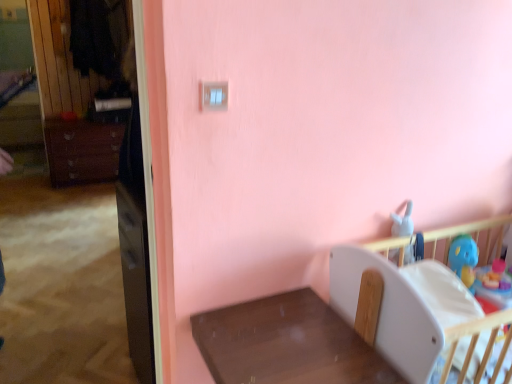
What are the coordinates of `blue rubber duck at right` in the screenshot? It's located at (464, 259).

This screenshot has width=512, height=384. What do you see at coordinates (464, 259) in the screenshot? I see `blue rubber duck at right` at bounding box center [464, 259].

Where is `blue rubber duck at right`? blue rubber duck at right is located at coordinates (464, 259).

How far apart are blue rubber duck at right and white plastic infant bed at lower right?

14.43 inches.

From the image's perspective, which is below, blue rubber duck at right or white plastic infant bed at lower right?

white plastic infant bed at lower right, from the image's perspective.

What's the angular difference between blue rubber duck at right and white plastic infant bed at lower right's facing directions?

0.409 degrees.

Between blue rubber duck at right and white plastic infant bed at lower right, which one is positioned in front?

white plastic infant bed at lower right is in front.

What's the angular difference between brown wooden table at lower center and matte brown dresser at left's facing directions?

They differ by 2.76 degrees in their facing directions.

Is brown wooden table at lower center bigger than matte brown dresser at left?

No.

Would you say brown wooden table at lower center contains matte brown dresser at left?

No.

Could you tell me if brown wooden table at lower center is turned towards matte brown dresser at left?

No, brown wooden table at lower center is not turned towards matte brown dresser at left.

From the image's perspective, is matte brown dresser at left positioned above or below brown wooden table at lower center?

Based on their image positions, matte brown dresser at left is located above brown wooden table at lower center.

Is matte brown dresser at left situated inside brown wooden table at lower center or outside?

matte brown dresser at left is not inside brown wooden table at lower center, it's outside.

Is matte brown dresser at left positioned with its back to brown wooden table at lower center?

matte brown dresser at left is not turned away from brown wooden table at lower center.

Is matte brown dresser at left not near brown wooden table at lower center?

matte brown dresser at left is far away from brown wooden table at lower center.

From the image's perspective, is blue rubber duck at right positioned above or below brown wooden table at lower center?

Clearly, from the image's perspective, blue rubber duck at right is above brown wooden table at lower center.

Which point is more forward, (469,285) or (219,359)?

The point (219,359) is in front.

From a real-world perspective, between blue rubber duck at right and brown wooden table at lower center, who is vertically higher?

blue rubber duck at right.

Is blue rubber duck at right taller than brown wooden table at lower center?

In fact, blue rubber duck at right may be shorter than brown wooden table at lower center.

Can you confirm if brown wooden table at lower center is positioned to the left of white plastic infant bed at lower right?

Correct, you'll find brown wooden table at lower center to the left of white plastic infant bed at lower right.

Consider the image. Considering their positions, is brown wooden table at lower center located in front of or behind white plastic infant bed at lower right?

brown wooden table at lower center is positioned closer to the viewer than white plastic infant bed at lower right.

In terms of width, does brown wooden table at lower center look wider or thinner when compared to white plastic infant bed at lower right?

Clearly, brown wooden table at lower center has less width compared to white plastic infant bed at lower right.

Is brown wooden table at lower center positioned beyond the bounds of white plastic infant bed at lower right?

brown wooden table at lower center lies outside white plastic infant bed at lower right's area.

Consider the image. Could you tell me if white plastic infant bed at lower right is turned towards matte black file cabinet at left?

No, white plastic infant bed at lower right is not aimed at matte black file cabinet at left.

Which object is wider, white plastic infant bed at lower right or matte black file cabinet at left?

white plastic infant bed at lower right is wider.

Does white plastic infant bed at lower right lie behind matte black file cabinet at left?

No, white plastic infant bed at lower right is in front of matte black file cabinet at left.

The image size is (512, 384). In order to click on infant bed below the matte black file cabinet at left (from the image's perspective) in this screenshot , I will do `click(417, 315)`.

Which is correct: matte brown dresser at left is inside blue rubber duck at right, or outside of it?

matte brown dresser at left is located beyond the bounds of blue rubber duck at right.

Is matte brown dresser at left to the left of blue rubber duck at right from the viewer's perspective?

Yes.

Is matte brown dresser at left in contact with blue rubber duck at right?

matte brown dresser at left is not next to blue rubber duck at right, and they're not touching.

Which of these two, matte brown dresser at left or blue rubber duck at right, is smaller?

blue rubber duck at right is smaller.

You are a GUI agent. You are given a task and a screenshot of the screen. Output one action in this format:
    pyautogui.click(x=<x>, y=<y>)
    Task: Click on the infant bed on the left of blue rubber duck at right
    The height and width of the screenshot is (384, 512).
    Given the screenshot: What is the action you would take?
    pyautogui.click(x=417, y=315)

Locate an element on the screen. The height and width of the screenshot is (384, 512). furniture that appears on the right of matte brown dresser at left is located at coordinates (287, 344).

From the image, which object appears to be farther from matte black file cabinet at left, brown wooden table at lower center or matte brown dresser at left?

matte brown dresser at left is positioned further to the anchor matte black file cabinet at left.

Considering their positions, is white plastic infant bed at lower right positioned closer to brown wooden table at lower center than blue rubber duck at right?

white plastic infant bed at lower right.

Based on their spatial positions, is brown wooden table at lower center or white plastic infant bed at lower right further from blue rubber duck at right?

Among the two, brown wooden table at lower center is located further to blue rubber duck at right.

Looking at the image, which one is located further to matte brown dresser at left, matte black file cabinet at left or white plastic infant bed at lower right?

Based on the image, white plastic infant bed at lower right appears to be further to matte brown dresser at left.

Looking at the image, which one is located closer to matte brown dresser at left, blue rubber duck at right or white plastic infant bed at lower right?

white plastic infant bed at lower right is positioned closer to the anchor matte brown dresser at left.

Based on their spatial positions, is matte brown dresser at left or matte black file cabinet at left further from white plastic infant bed at lower right?

The object further to white plastic infant bed at lower right is matte brown dresser at left.

Considering their positions, is matte black file cabinet at left positioned closer to white plastic infant bed at lower right than matte brown dresser at left?

The object closer to white plastic infant bed at lower right is matte black file cabinet at left.

Which object lies nearer to the anchor point matte black file cabinet at left, matte brown dresser at left or brown wooden table at lower center?

brown wooden table at lower center is closer to matte black file cabinet at left.

Where is `furniture located between matte black file cabinet at left and white plastic infant bed at lower right in the left-right direction`? furniture located between matte black file cabinet at left and white plastic infant bed at lower right in the left-right direction is located at coordinates pos(287,344).

Locate an element on the screen. infant bed between brown wooden table at lower center and matte brown dresser at left in the front-back direction is located at coordinates [x=417, y=315].

Where is `toy located between brown wooden table at lower center and matte brown dresser at left in the depth direction`? toy located between brown wooden table at lower center and matte brown dresser at left in the depth direction is located at coordinates (464, 259).

The image size is (512, 384). What are the coordinates of `toy between matte black file cabinet at left and matte brown dresser at left along the z-axis` in the screenshot? It's located at (464, 259).